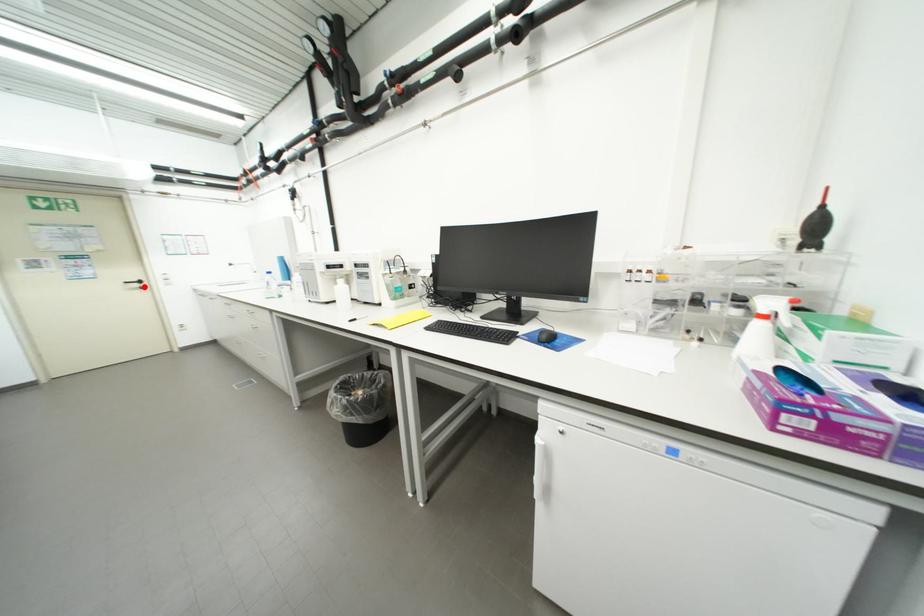
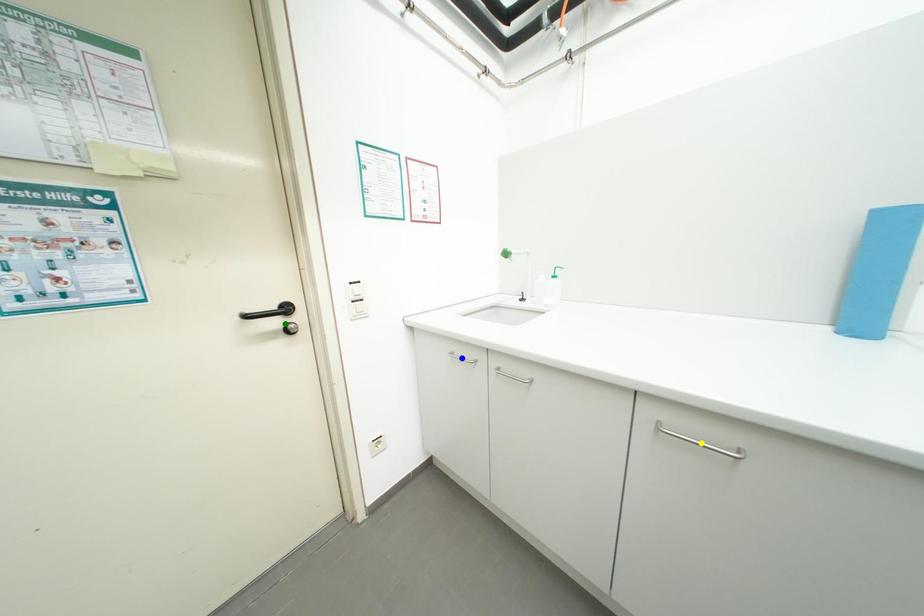
Question: I am providing you with two images of the same scene from different viewpoints. A red point is marked on the first image. You are given multiple points on the second image. Can you choose the point in image 2 that corresponds to the point in image 1?

Choices:
 (A) blue point
 (B) green point
 (C) yellow point

Answer: (B)